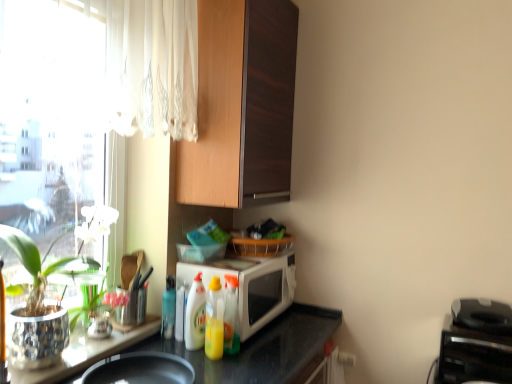
You are a GUI agent. You are given a task and a screenshot of the screen. Output one action in this format:
    pyautogui.click(x=<x>, y=<y>)
    Task: Click on the free point above black plastic toaster at lower right (from a real-world perspective)
    Image resolution: width=512 pixels, height=384 pixels.
    Given the screenshot: What is the action you would take?
    pyautogui.click(x=479, y=335)